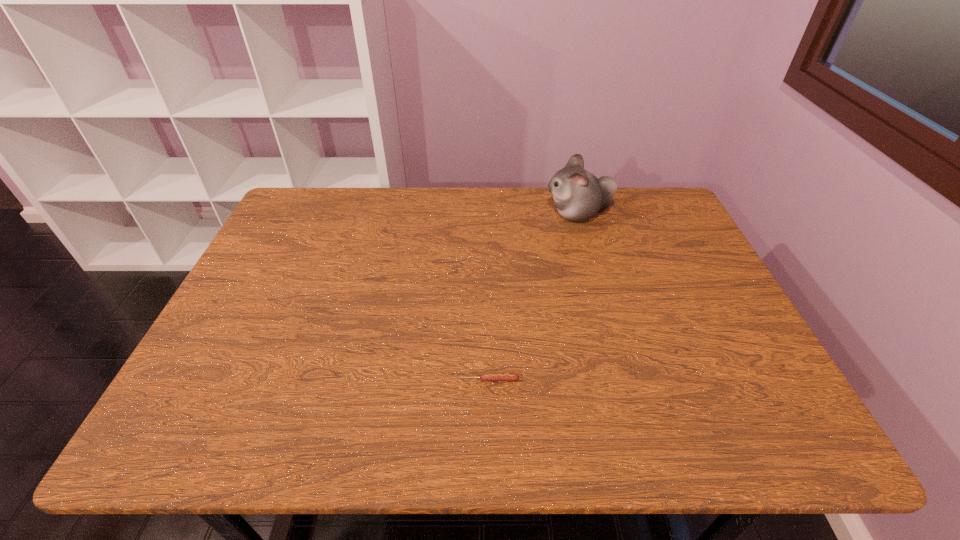
Where is `the farther object`? The height and width of the screenshot is (540, 960). the farther object is located at coordinates (579, 195).

At what (x,y) coordinates should I click in order to perform the action: click on the taller object. Please return your answer as a coordinate pair (x, y). This screenshot has height=540, width=960. Looking at the image, I should click on (579, 195).

Where is `the left object`? the left object is located at coordinates (483, 377).

At what (x,y) coordinates should I click in order to perform the action: click on the shorter object. Please return your answer as a coordinate pair (x, y). The width and height of the screenshot is (960, 540). Looking at the image, I should click on (483, 377).

Where is `vacant space located 0.160m on the face of the hamster`? The height and width of the screenshot is (540, 960). vacant space located 0.160m on the face of the hamster is located at coordinates (494, 214).

At what (x,y) coordinates should I click in order to perform the action: click on vacant area situated on the face of the hamster. Please return your answer as a coordinate pair (x, y). Looking at the image, I should click on (479, 214).

Locate an element on the screen. free region located 0.120m on the face of the hamster is located at coordinates (507, 214).

Where is `vacant point located 0.150m on the right of the shorter object`? The image size is (960, 540). vacant point located 0.150m on the right of the shorter object is located at coordinates (588, 380).

Identify the location of object at the far edge. Image resolution: width=960 pixels, height=540 pixels. (579, 195).

This screenshot has height=540, width=960. In the image, there is a desktop. Find the location of `vacant area at the far edge`. vacant area at the far edge is located at coordinates (357, 222).